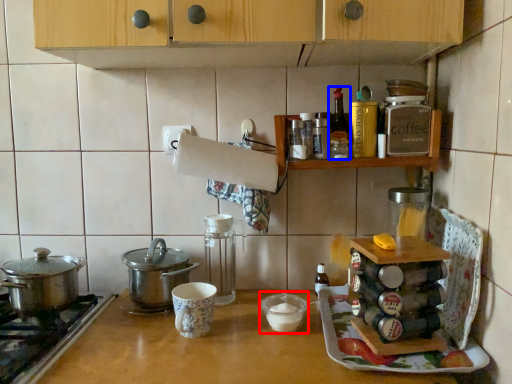
Question: Which point is closer to the camera, appliance (highlighted by a red box) or kitchen appliance (highlighted by a blue box)?

Choices:
 (A) appliance
 (B) kitchen appliance

Answer: (A)